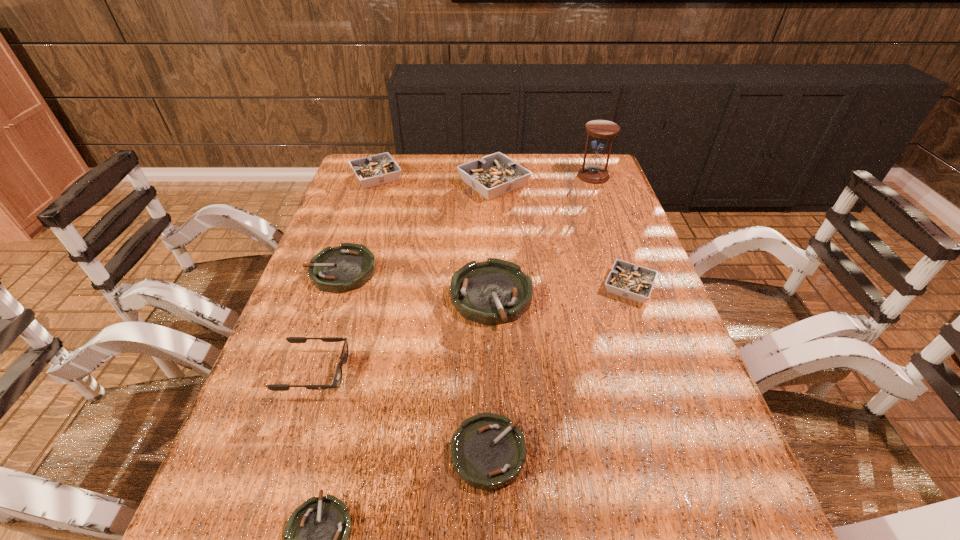
The height and width of the screenshot is (540, 960). In order to click on free space between the tallest object and the biggest green ashtray in this screenshot , I will do `click(542, 236)`.

Locate an element on the screen. This screenshot has width=960, height=540. free space between the leftmost gray ashtray and the second biggest green ashtray is located at coordinates (359, 224).

You are a GUI agent. You are given a task and a screenshot of the screen. Output one action in this format:
    pyautogui.click(x=<x>, y=<y>)
    Task: Click on the vacant area between the nearest gray ashtray and the leftmost gray ashtray
    
    Given the screenshot: What is the action you would take?
    pyautogui.click(x=503, y=232)

Where is `empty space between the sunglasses and the second gray ashtray from right to left`? empty space between the sunglasses and the second gray ashtray from right to left is located at coordinates (404, 278).

This screenshot has width=960, height=540. Identify the location of vacant area that lies between the tallest object and the sunglasses. (454, 274).

You are a GUI agent. You are given a task and a screenshot of the screen. Output one action in this format:
    pyautogui.click(x=<x>, y=<y>)
    Task: Click on the vacant space in between the third smallest green ashtray and the third nearest object
    This screenshot has width=960, height=540.
    Given the screenshot: What is the action you would take?
    pyautogui.click(x=327, y=321)

This screenshot has height=540, width=960. What are the coordinates of `free space between the biggest green ashtray and the sunglasses` in the screenshot? It's located at (403, 334).

Image resolution: width=960 pixels, height=540 pixels. Identify the location of the third closest object to the shortest ashtray. (493, 292).

The width and height of the screenshot is (960, 540). I want to click on object that is the third closest one to the smallest gray ashtray, so click(x=488, y=451).

Select which ashtray is the fourth closest to the third smallest green ashtray. Please provide its 2D coordinates. Your answer should be formatted as a tuple, i.e. [(x, y)], where the tuple contains the x and y coordinates of a point satisfying the conditions above.

[(488, 451)]